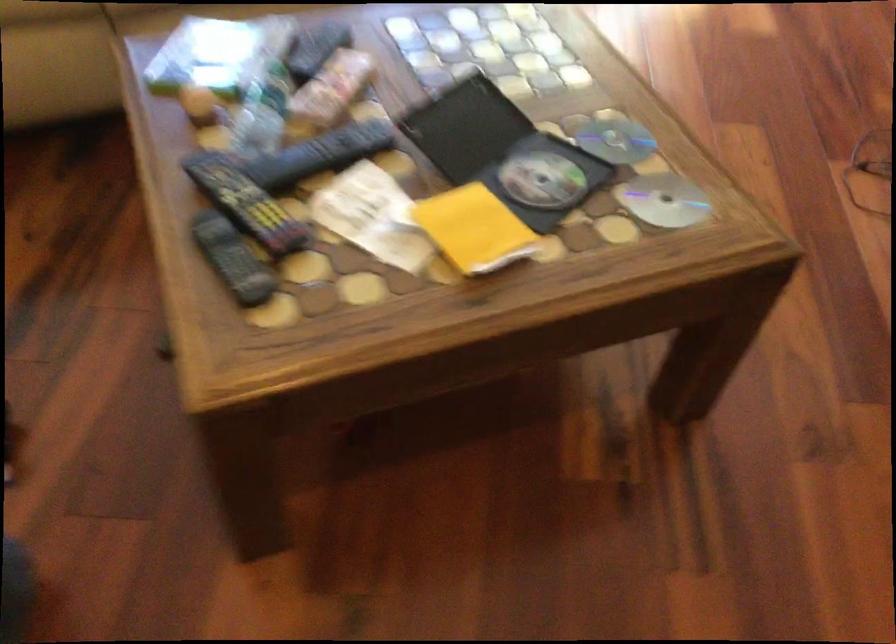
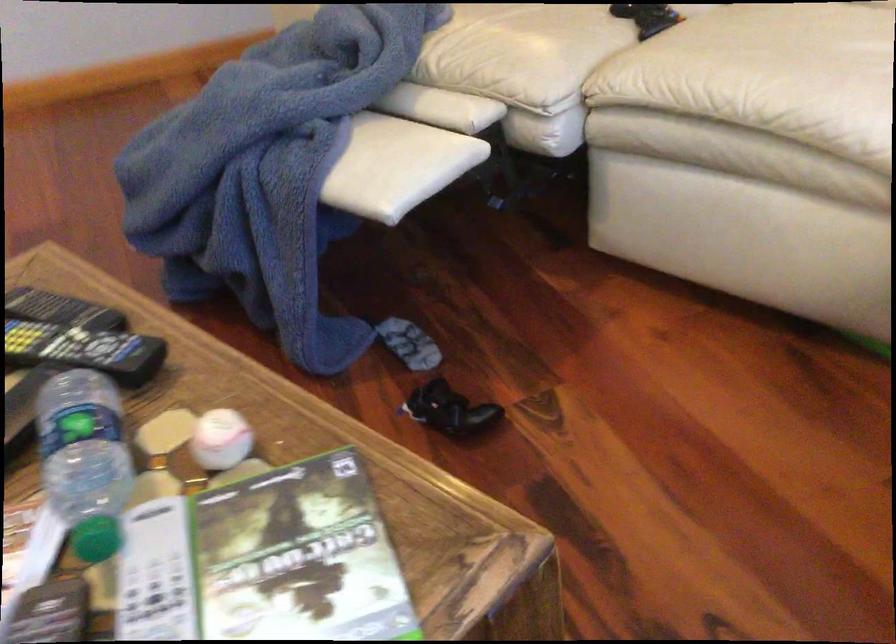
The point at (220,80) is marked in the first image. Where is the corresponding point in the second image?

(220, 439)